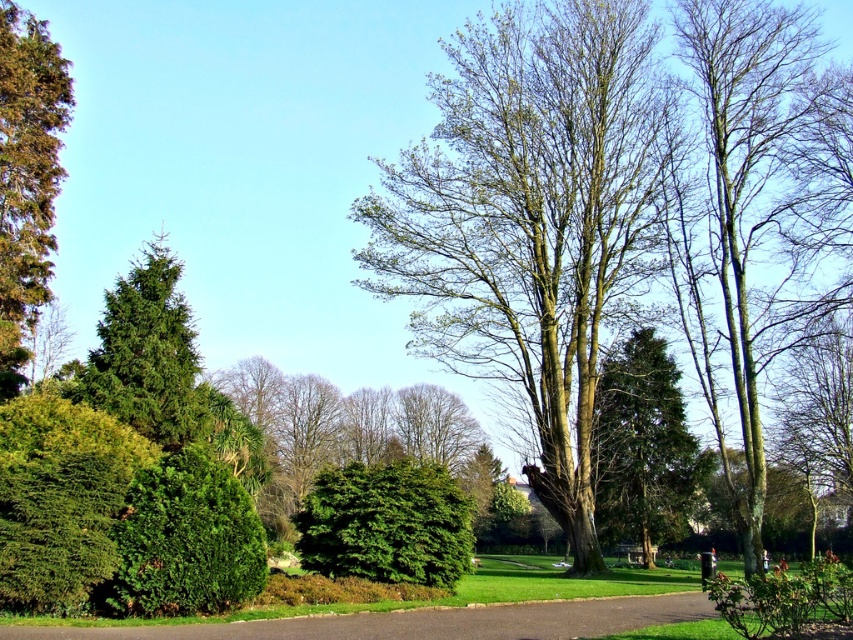
You are standing at the point with coordinates point (155, 579) and want to walk to the point with coordinates point (490, 244). Considering the park layout described, will the path be visible to you from your starting position?

Point (490, 244) is behind point (155, 579), so the path to point (490, 244) may be obstructed by objects or terrain between them, making it not fully visible from your starting position.

You are standing at the entrance of the park and want to find the green textured tree at center. According to the coordinates provided, where should you look in the image?

The green textured tree at center is located at coordinates point (643,445).